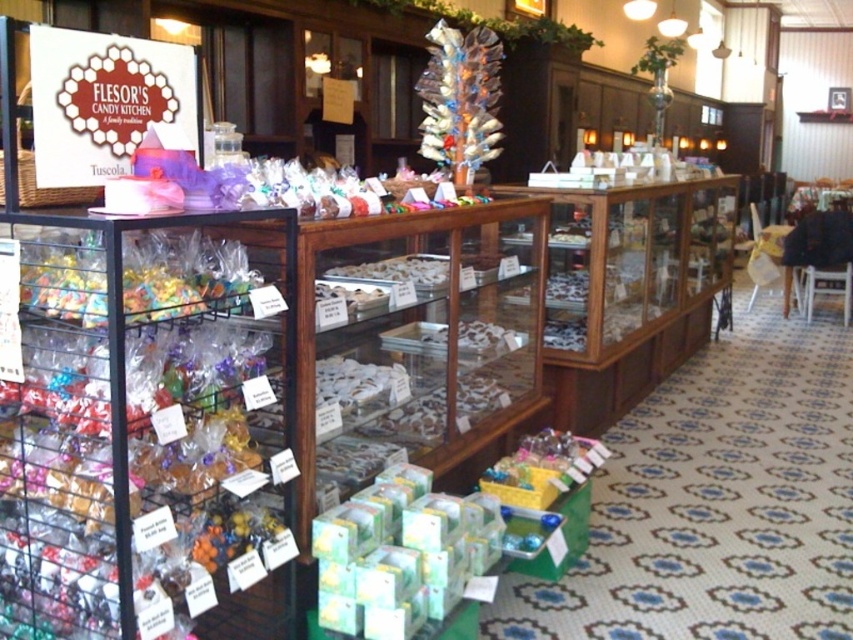
Which is in front, point (436, 150) or point (480, 324)?

Positioned in front is point (436, 150).

Is translucent plastic candy at upper center below white glossy chocolate at center?

Actually, translucent plastic candy at upper center is above white glossy chocolate at center.

Measure the distance between translucent plastic candy at upper center and camera.

The distance of translucent plastic candy at upper center from camera is 9.06 feet.

Identify the location of translucent plastic candy at upper center. The image size is (853, 640). (460, 99).